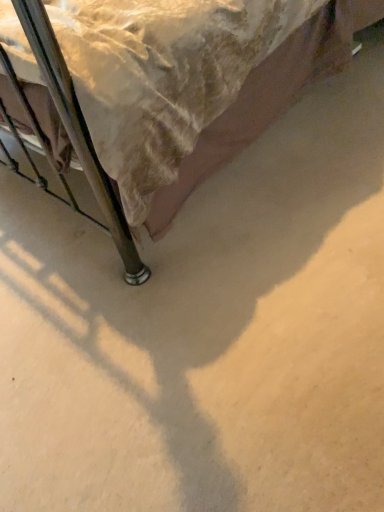
This screenshot has height=512, width=384. What are the coordinates of `metallic bed at upper left` in the screenshot? It's located at (78, 130).

What do you see at coordinates (78, 130) in the screenshot? Image resolution: width=384 pixels, height=512 pixels. I see `metallic bed at upper left` at bounding box center [78, 130].

Where is `metallic bed at upper left`? The width and height of the screenshot is (384, 512). metallic bed at upper left is located at coordinates (78, 130).